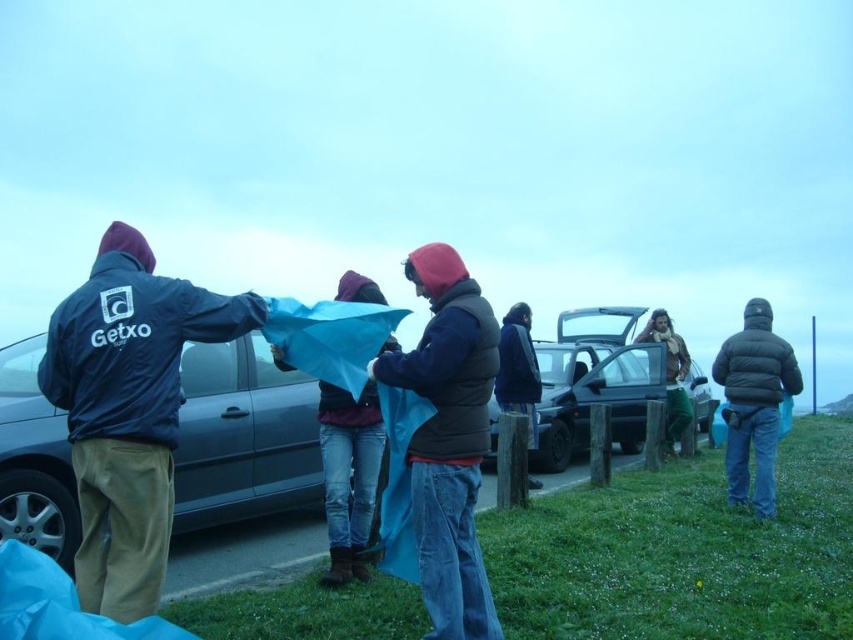
Question: Does dark blue jacket at left come behind dark blue puffy vest at center?

Choices:
 (A) no
 (B) yes

Answer: (A)

Question: Among these objects, which one is nearest to the camera?

Choices:
 (A) metallic silver car at center
 (B) matte blue car at left
 (C) dark blue jacket at center
 (D) green fabric at center

Answer: (B)

Question: Which object is closer to the camera taking this photo?

Choices:
 (A) metallic silver car at center
 (B) green fabric at center

Answer: (A)

Question: Does matte blue car at left have a lesser width compared to metallic silver car at center?

Choices:
 (A) no
 (B) yes

Answer: (B)

Question: Does dark blue puffy vest at center appear over blue fabric at center?

Choices:
 (A) no
 (B) yes

Answer: (B)

Question: Which is nearer to the matte blue car at left?

Choices:
 (A) metallic silver car at center
 (B) blue fabric at center
 (C) dark blue puffy vest at center

Answer: (B)